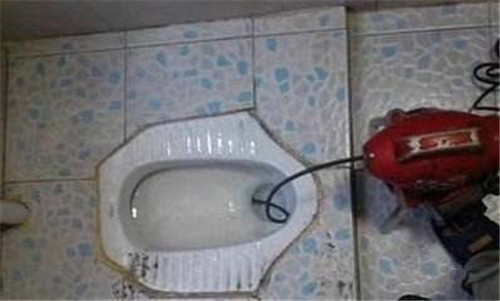
You are a GUI agent. You are given a task and a screenshot of the screen. Output one action in this format:
    pyautogui.click(x=<x>, y=<y>)
    Task: Click on the toilet bowl hole
    
    Given the screenshot: What is the action you would take?
    pyautogui.click(x=263, y=195)